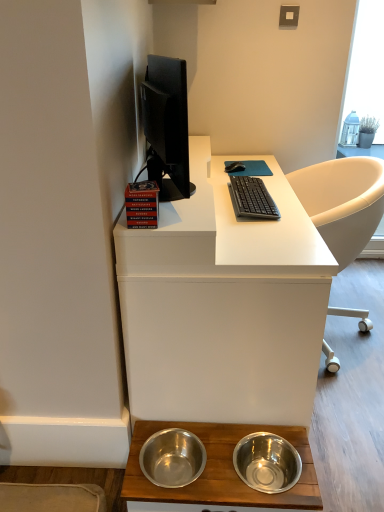
Question: From a real-world perspective, relative to black plastic keyboard at center, is white matte desk at center, arranged as the 2th desk when ordered from the bottom, vertically above or below?

Choices:
 (A) above
 (B) below

Answer: (B)

Question: Based on their sizes in the image, would you say white matte desk at center, which appears as the first desk when viewed from the top, is bigger or smaller than black plastic keyboard at center?

Choices:
 (A) small
 (B) big

Answer: (B)

Question: Which of these objects is positioned closest to the black plastic keyboard at center?

Choices:
 (A) white matte desk at center, arranged as the 2th desk when ordered from the bottom
 (B) black rubber mouse at center
 (C) white leather chair at right
 (D) stainless steel bowls at lower center, marked as the 1th desk in a bottom-to-top arrangement

Answer: (A)

Question: Which object is positioned farthest from the white matte desk at center, which appears as the first desk when viewed from the top?

Choices:
 (A) white leather chair at right
 (B) stainless steel bowls at lower center, marked as the 1th desk in a bottom-to-top arrangement
 (C) black plastic keyboard at center
 (D) black rubber mouse at center

Answer: (D)